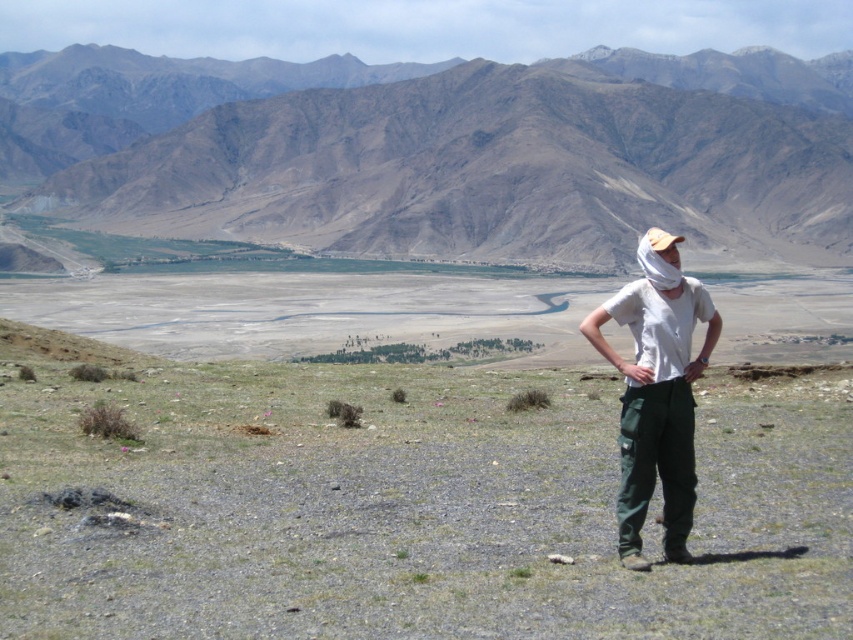
Question: Observing the image, what is the correct spatial positioning of brown rocky mountain at upper center in reference to white cotton shirt at center?

Choices:
 (A) left
 (B) right

Answer: (B)

Question: Does brown rocky mountain at upper center have a larger size compared to white cotton shirt at center?

Choices:
 (A) no
 (B) yes

Answer: (B)

Question: Which of the following is the closest to the observer?

Choices:
 (A) white cotton shirt at center
 (B) brown rocky mountain at upper center

Answer: (A)

Question: Does brown rocky mountain at upper center appear over white cotton shirt at center?

Choices:
 (A) yes
 (B) no

Answer: (A)

Question: Among these objects, which one is farthest from the camera?

Choices:
 (A) brown rocky mountain at upper center
 (B) white cotton shirt at center

Answer: (A)